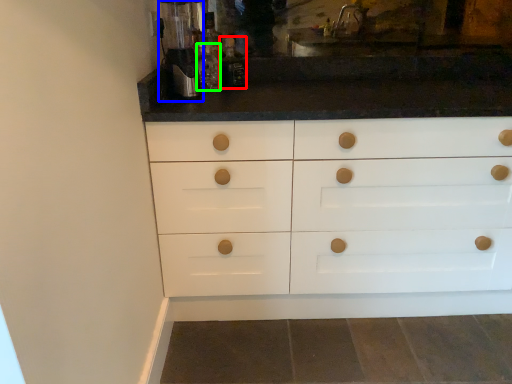
Question: Considering the real-world distances, which object is farthest from bottle (highlighted by a red box)? coffee machine (highlighted by a blue box) or bottle (highlighted by a green box)?

Choices:
 (A) coffee machine
 (B) bottle

Answer: (A)